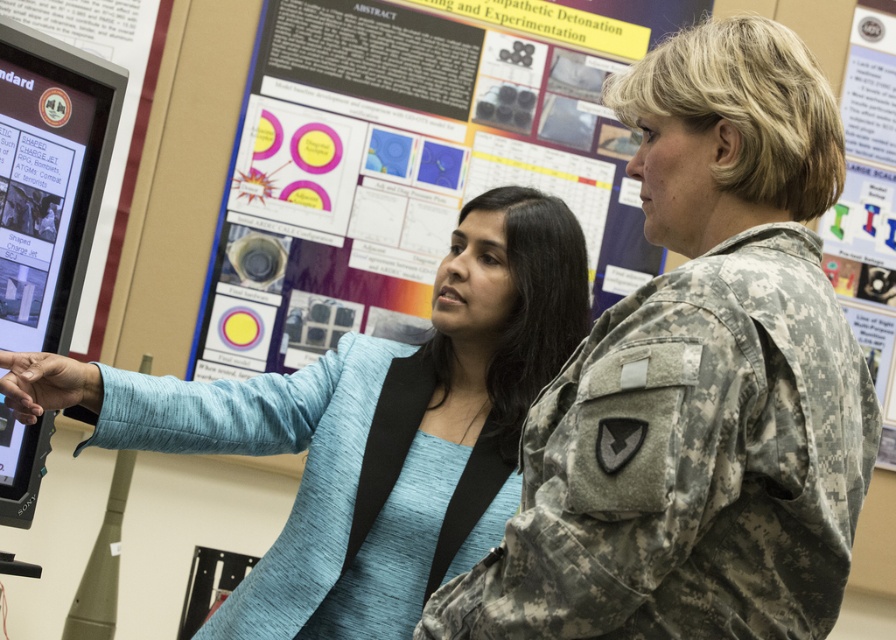
Question: From the image, what is the correct spatial relationship of matte paper poster at center in relation to matte paper poster at upper right?

Choices:
 (A) left
 (B) right

Answer: (A)

Question: Can you confirm if camouflage uniform at center is bigger than matte paper poster at upper right?

Choices:
 (A) no
 (B) yes

Answer: (B)

Question: Which object appears farthest from the camera in this image?

Choices:
 (A) blue fabric jacket at center
 (B) matte paper poster at center

Answer: (B)

Question: Which object appears closest to the camera in this image?

Choices:
 (A) matte paper poster at center
 (B) blue fabric jacket at center
 (C) matte black monitor at left

Answer: (B)

Question: Is matte paper poster at center bigger than matte paper poster at upper right?

Choices:
 (A) no
 (B) yes

Answer: (B)

Question: Estimate the real-world distances between objects in this image. Which object is closer to the matte paper poster at upper right?

Choices:
 (A) matte black monitor at left
 (B) blue fabric jacket at center

Answer: (B)